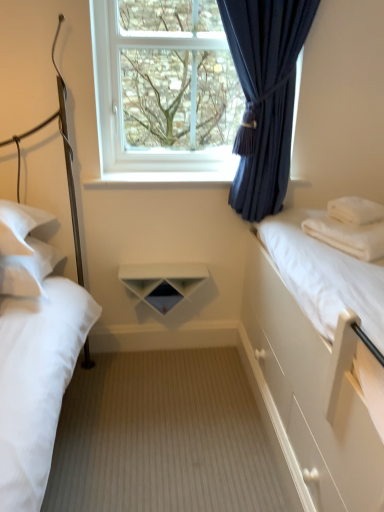
This screenshot has height=512, width=384. Find the location of `vacant space that is to the left of white soft pillow at right, the 1th pillow in the right-to-left sequence`. vacant space that is to the left of white soft pillow at right, the 1th pillow in the right-to-left sequence is located at coordinates (321, 221).